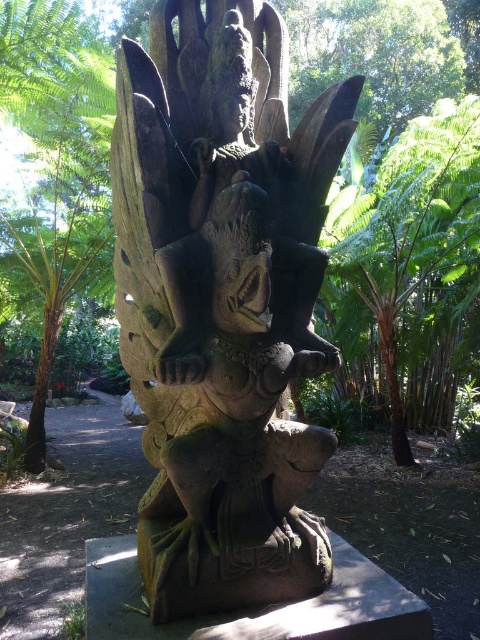
Question: Among these points, which one is farthest from the camera?

Choices:
 (A) (224, 49)
 (B) (393, 396)

Answer: (B)

Question: Which point appears closest to the camera in this image?

Choices:
 (A) (414, 275)
 (B) (49, 321)
 (C) (180, 184)
 (D) (405, 456)

Answer: (C)

Question: Is dark stone statue at center above green leafy tree at left?

Choices:
 (A) yes
 (B) no

Answer: (B)

Question: Which of the following is the farthest from the observer?

Choices:
 (A) brown rough tree trunk at right
 (B) green leafy tree at left

Answer: (A)

Question: Does green leafy tree at upper center have a smaller size compared to green rough bark tree trunk at left?

Choices:
 (A) yes
 (B) no

Answer: (B)

Question: Is dark stone statue at center bigger than brown rough tree trunk at right?

Choices:
 (A) yes
 (B) no

Answer: (A)